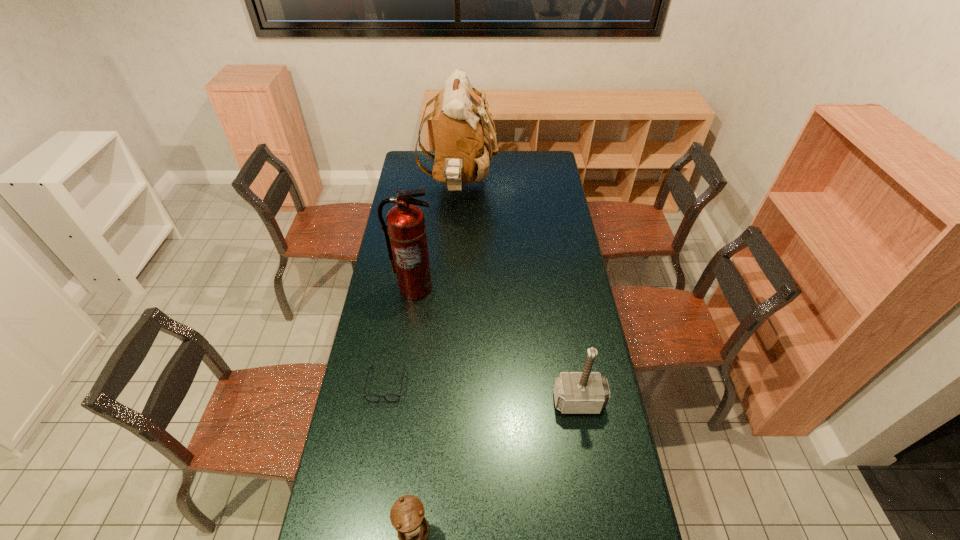
Locate an element on the screen. This screenshot has width=960, height=540. free space between the rightmost object and the backpack is located at coordinates (518, 293).

In order to click on free space between the shortest object and the hammer in this screenshot , I will do `click(482, 393)`.

What are the coordinates of `free spot between the spectacles and the fourth nearest object` in the screenshot? It's located at (400, 336).

Identify the location of free point between the third shortest object and the spectacles. This screenshot has width=960, height=540. (482, 393).

This screenshot has width=960, height=540. Find the location of `vacant space that is in between the shortest object and the hammer`. vacant space that is in between the shortest object and the hammer is located at coordinates (482, 393).

The height and width of the screenshot is (540, 960). Identify the location of free spot between the fourth nearest object and the farthest object. (437, 237).

Select which object appears as the third closest to the shortest object. Please provide its 2D coordinates. Your answer should be formatted as a tuple, i.e. [(x, y)], where the tuple contains the x and y coordinates of a point satisfying the conditions above.

[(586, 392)]

At what (x,y) coordinates should I click in order to perform the action: click on the fourth closest object relative to the farthest object. Please return your answer as a coordinate pair (x, y). Looking at the image, I should click on (407, 514).

Where is `blank space that satisfies the following two spatial constraints: 1. on the front-facing side of the backpack; 2. on the front-facing side of the spectacles`? The image size is (960, 540). blank space that satisfies the following two spatial constraints: 1. on the front-facing side of the backpack; 2. on the front-facing side of the spectacles is located at coordinates [448, 384].

Identify the location of blank area in the image that satisfies the following two spatial constraints: 1. on the front-facing side of the backpack; 2. on the side of the fire extinguisher with the handle and hose. Image resolution: width=960 pixels, height=540 pixels. (453, 288).